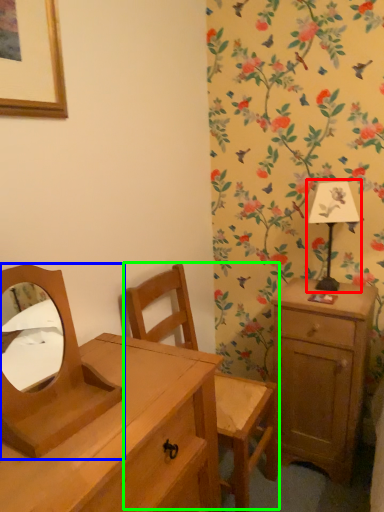
Question: Considering the real-world distances, which object is farthest from bedside lamp (highlighted by a red box)? mirror (highlighted by a blue box) or swivel chair (highlighted by a green box)?

Choices:
 (A) mirror
 (B) swivel chair

Answer: (A)